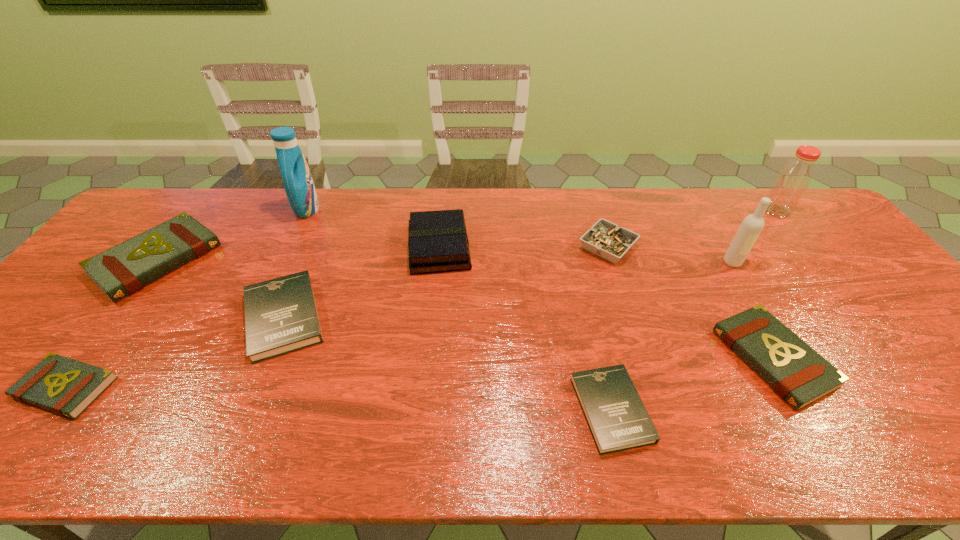
This screenshot has width=960, height=540. I want to click on object present at the far left corner, so coord(124,269).

I want to click on object at the far right corner, so click(792, 181).

Find the location of `free space at the far edge of the desktop`. free space at the far edge of the desktop is located at coordinates (258, 217).

Locate an element on the screen. Image resolution: width=960 pixels, height=540 pixels. vacant space at the near edge is located at coordinates (765, 438).

Identify the location of vacant space at the left edge of the desktop. This screenshot has width=960, height=540. (26, 342).

Locate an element on the screen. This screenshot has width=960, height=540. vacant area at the right edge is located at coordinates 854,311.

Locate an element on the screen. This screenshot has width=960, height=540. blank space at the far right corner of the desktop is located at coordinates (817, 217).

The height and width of the screenshot is (540, 960). Find the location of `free spot between the nearer dark book and the rightmost object`. free spot between the nearer dark book and the rightmost object is located at coordinates (694, 310).

Locate an element on the screen. This screenshot has width=960, height=540. vacant area that lies between the tallest book and the white vodka is located at coordinates (586, 255).

Locate an element on the screen. The width and height of the screenshot is (960, 540). free spot between the red bottle and the nearer dark book is located at coordinates (694, 310).